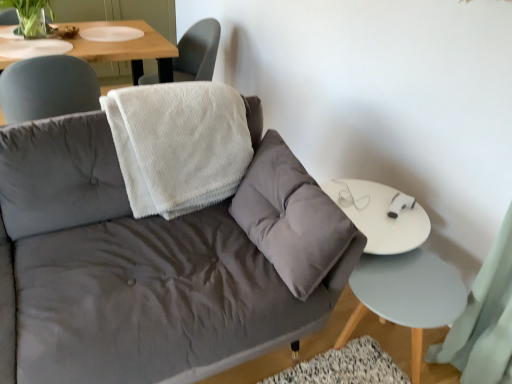
Question: Could velvet gray couch at center be considered to be inside white fluffy blanket at upper center?

Choices:
 (A) no
 (B) yes

Answer: (A)

Question: Is the position of white fluffy blanket at upper center less distant than that of velvet gray couch at center?

Choices:
 (A) no
 (B) yes

Answer: (A)

Question: From a real-world perspective, is white fluffy blanket at upper center over velvet gray couch at center?

Choices:
 (A) yes
 (B) no

Answer: (A)

Question: Can you confirm if white fluffy blanket at upper center is wider than velvet gray couch at center?

Choices:
 (A) yes
 (B) no

Answer: (B)

Question: Does white fluffy blanket at upper center lie behind velvet gray couch at center?

Choices:
 (A) yes
 (B) no

Answer: (A)

Question: Considering the positions of point (28, 195) and point (31, 26), is point (28, 195) closer or farther from the camera than point (31, 26)?

Choices:
 (A) closer
 (B) farther

Answer: (A)

Question: Looking at their shapes, would you say velvet gray couch at center is wider or thinner than green matte plant at upper left?

Choices:
 (A) thin
 (B) wide

Answer: (B)

Question: In terms of size, does velvet gray couch at center appear bigger or smaller than green matte plant at upper left?

Choices:
 (A) big
 (B) small

Answer: (A)

Question: Visually, is velvet gray couch at center positioned to the left or to the right of green matte plant at upper left?

Choices:
 (A) left
 (B) right

Answer: (B)

Question: From a real-world perspective, is velvet gray couch at center positioned above or below white fluffy blanket at upper center?

Choices:
 (A) below
 (B) above

Answer: (A)

Question: Does point (8, 187) appear closer or farther from the camera than point (147, 99)?

Choices:
 (A) farther
 (B) closer

Answer: (B)

Question: Is velvet gray couch at center to the left or to the right of white fluffy blanket at upper center in the image?

Choices:
 (A) left
 (B) right

Answer: (A)

Question: In the image, is velvet gray couch at center positioned in front of or behind white fluffy blanket at upper center?

Choices:
 (A) behind
 (B) front

Answer: (B)

Question: From the image's perspective, is light blue wood side table at lower right positioned above or below white fluffy blanket at upper center?

Choices:
 (A) below
 (B) above

Answer: (A)

Question: Is light blue wood side table at lower right taller or shorter than white fluffy blanket at upper center?

Choices:
 (A) short
 (B) tall

Answer: (A)